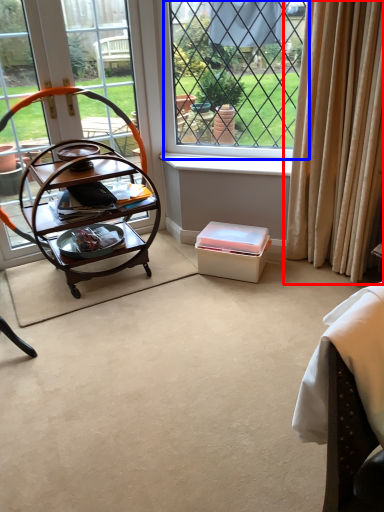
Question: Which object is closer to the camera taking this photo, curtain (highlighted by a red box) or window (highlighted by a blue box)?

Choices:
 (A) curtain
 (B) window

Answer: (A)